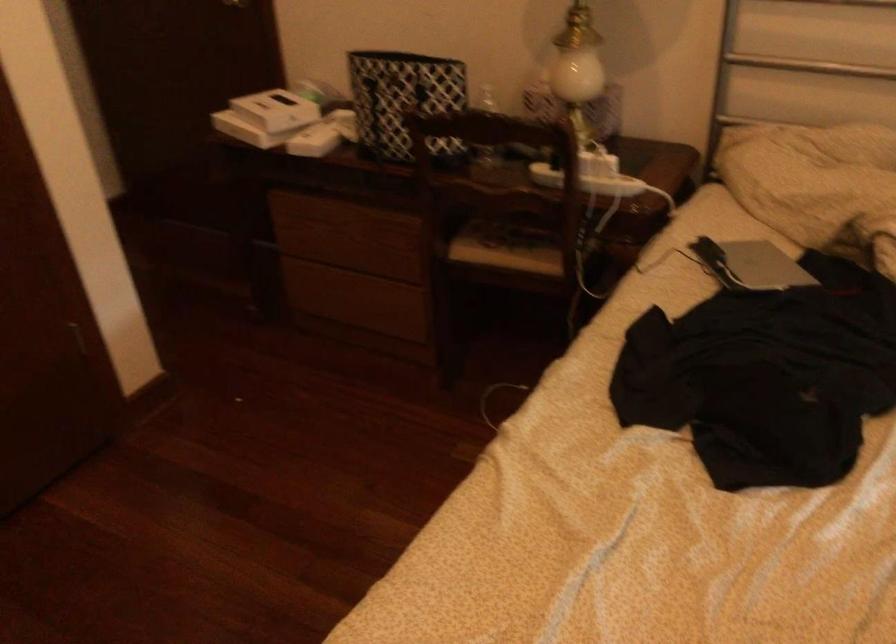
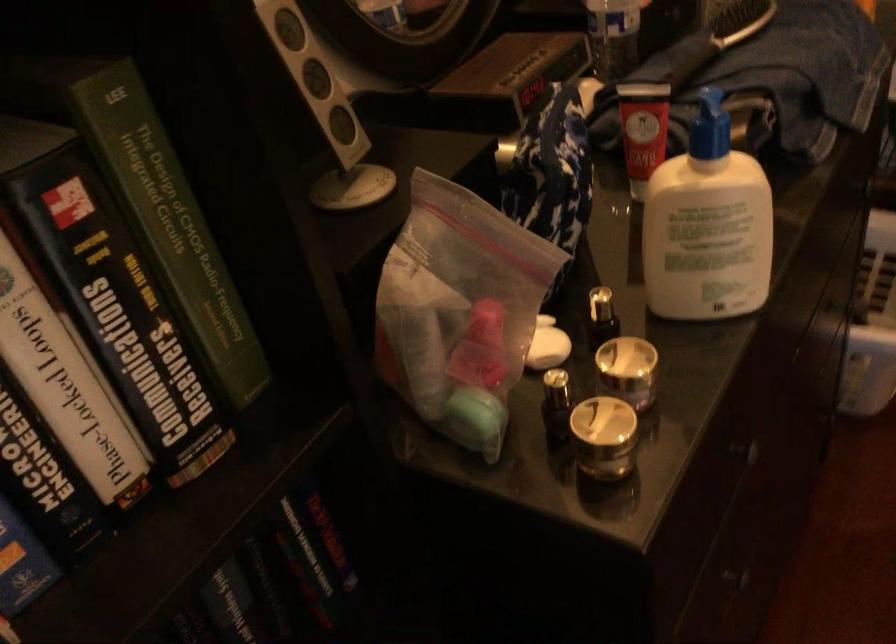
How did the camera likely rotate?

The camera rotated toward left-down.